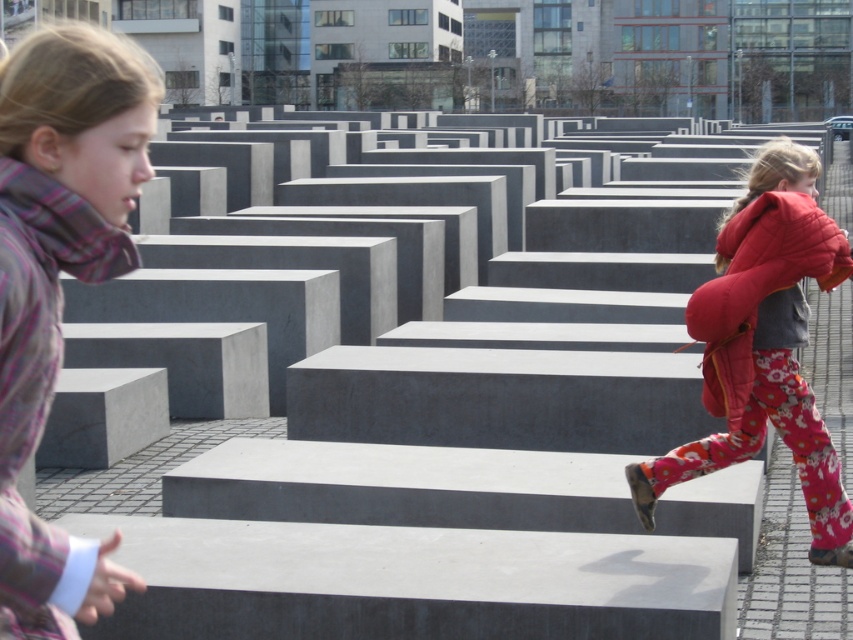
Question: Which point appears farthest from the camera in this image?

Choices:
 (A) (28, 314)
 (B) (630, 472)
 (C) (733, 225)

Answer: (B)

Question: Considering the relative positions of plaid wool scarf at left and floral pants at right in the image provided, where is plaid wool scarf at left located with respect to floral pants at right?

Choices:
 (A) right
 (B) left

Answer: (B)

Question: Is plaid wool scarf at left wider than matte red jacket at right?

Choices:
 (A) no
 (B) yes

Answer: (A)

Question: Which of the following is the closest to the observer?

Choices:
 (A) (750, 381)
 (B) (132, 93)

Answer: (B)

Question: Is floral pants at right thinner than matte red jacket at right?

Choices:
 (A) no
 (B) yes

Answer: (A)

Question: Which is farther from the floral pants at right?

Choices:
 (A) plaid wool scarf at left
 (B) matte red jacket at right

Answer: (A)